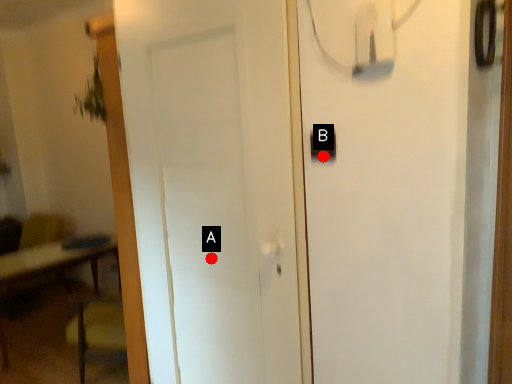
Question: Two points are circled on the image, labeled by A and B beside each circle. Which point is farther to the camera?

Choices:
 (A) A is further
 (B) B is further

Answer: (A)